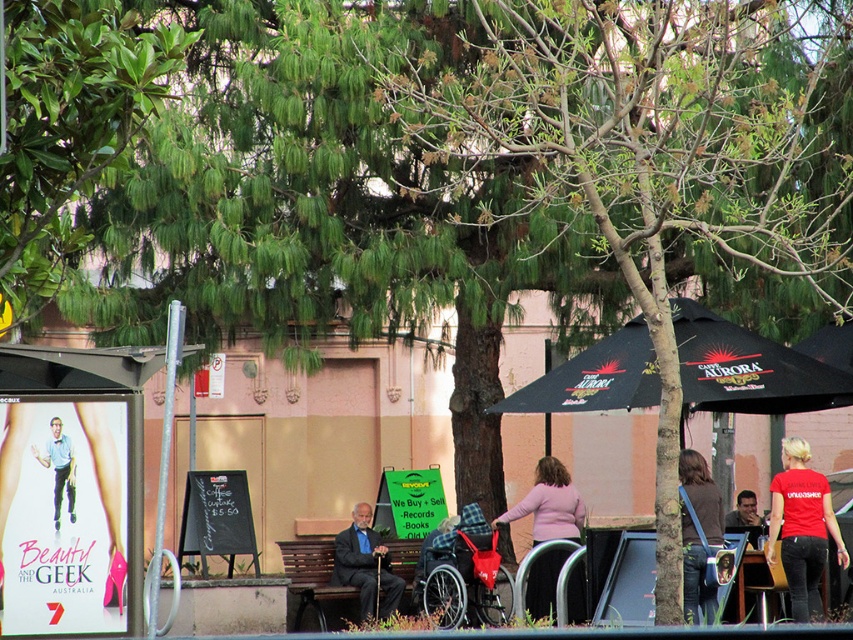
Question: Which of these objects is positioned farthest from the matte black suit at center?

Choices:
 (A) black fabric umbrella at center
 (B) wooden bench at center
 (C) dark brown leather jacket at center

Answer: (B)

Question: Is red cotton shirt at lower right to the right of denim jacket at lower right from the viewer's perspective?

Choices:
 (A) no
 (B) yes

Answer: (B)

Question: Which point is closer to the camera?

Choices:
 (A) (412, 596)
 (B) (577, 520)

Answer: (B)

Question: Does red cotton shirt at lower right come in front of smooth brown hair at lower right?

Choices:
 (A) yes
 (B) no

Answer: (A)

Question: Does pink fabric jacket at center appear on the right side of matte black suit at center?

Choices:
 (A) no
 (B) yes

Answer: (B)

Question: Which object is the closest to the red cotton shirt at lower right?

Choices:
 (A) pink fabric jacket at center
 (B) denim jacket at lower right
 (C) dark brown leather jacket at center
 (D) smooth brown hair at lower right

Answer: (B)